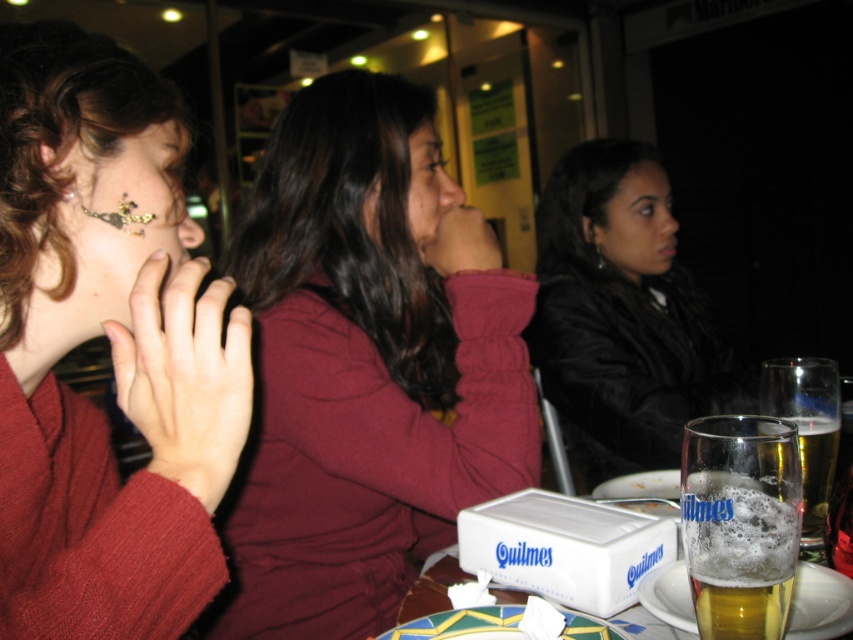
You are a fashion designer observing the scene. You notice two sweaters at the center of the image, the matte maroon sweater at center and the matte red sweater at center. Which one is positioned lower on the person wearing it?

The matte maroon sweater at center is positioned lower because it is below the matte red sweater at center.

In the scene described, there are two items of clothing and a beverage visible. The matte maroon sweater at center is worn by the middle woman, and the foamy golden beer at lower right is on the table. Considering their sizes, which item takes up more space in the image?

The matte maroon sweater at center has a larger size compared to the foamy golden beer at lower right, so the sweater takes up more space in the image.

You are a fashion designer observing three women at a table. You notice the matte maroon sweater at center and the matte red sweater at center. Which of these two sweaters appears taller on the person wearing it?

The matte maroon sweater at center appears taller on the person wearing it compared to the matte red sweater at center.